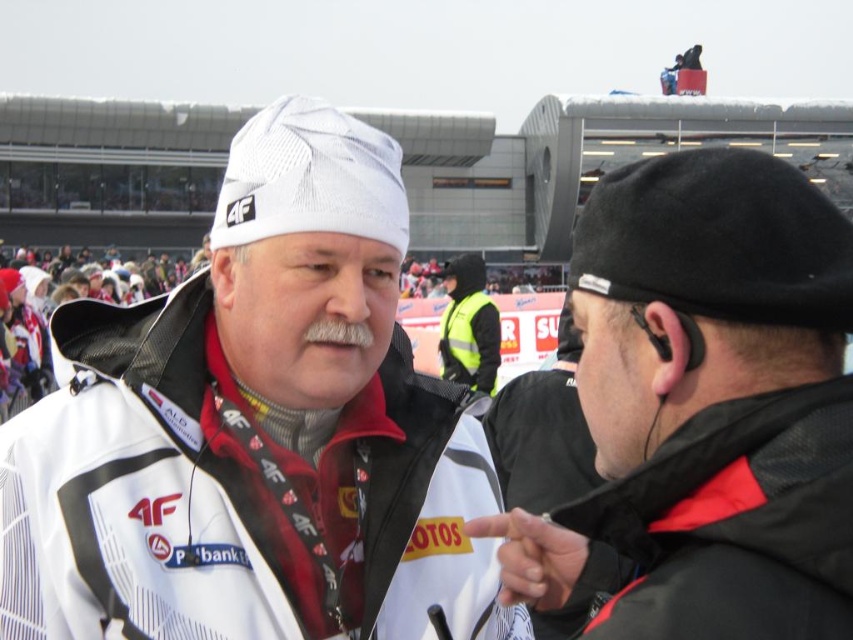
Question: Observing the image, what is the correct spatial positioning of black matte jacket at right in reference to high-visibility yellow vest at center?

Choices:
 (A) above
 (B) below

Answer: (B)

Question: Which object appears closest to the camera in this image?

Choices:
 (A) white mesh cap at upper center
 (B) black matte jacket at right
 (C) high-visibility yellow vest at center

Answer: (B)

Question: Which object is farther from the camera taking this photo?

Choices:
 (A) white mesh cap at upper center
 (B) black matte jacket at right
 (C) black matte earphone at right

Answer: (C)

Question: Can you confirm if white mesh cap at upper center is positioned above black matte jacket at right?

Choices:
 (A) no
 (B) yes

Answer: (B)

Question: Which of the following is the farthest from the observer?

Choices:
 (A) white mesh cap at upper center
 (B) black matte jacket at right

Answer: (A)

Question: Is white mesh cap at upper center to the left of high-visibility yellow vest at center from the viewer's perspective?

Choices:
 (A) yes
 (B) no

Answer: (A)